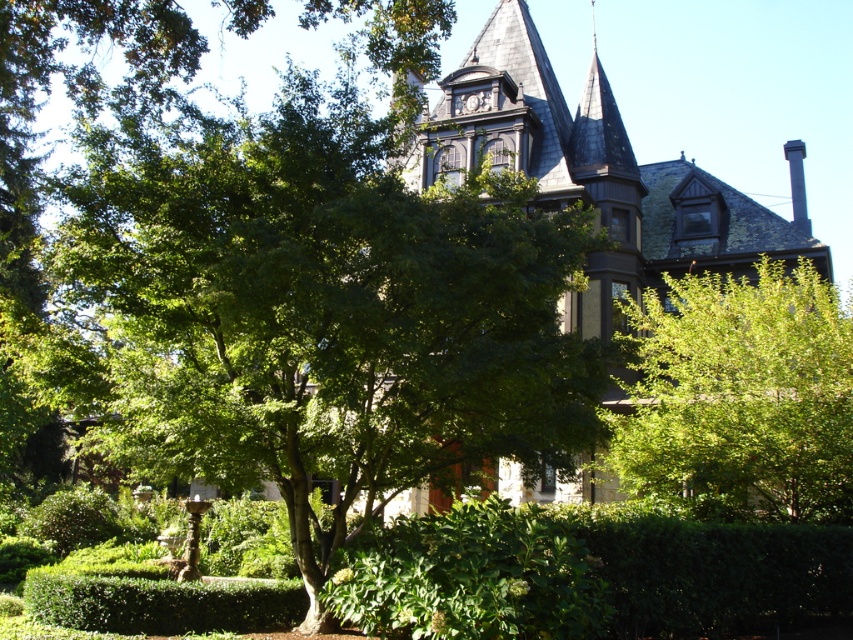
Question: Is green leafy tree at center positioned behind green leafy bush at right?

Choices:
 (A) no
 (B) yes

Answer: (A)

Question: Which of the following is the closest to the observer?

Choices:
 (A) green leafy bush at right
 (B) green leafy tree at center

Answer: (B)

Question: Which point appears closest to the camera in this image?

Choices:
 (A) (647, 412)
 (B) (473, 422)

Answer: (B)

Question: Is green leafy tree at center positioned in front of green leafy bush at right?

Choices:
 (A) no
 (B) yes

Answer: (B)

Question: Observing the image, what is the correct spatial positioning of green leafy tree at center in reference to green leafy bush at right?

Choices:
 (A) above
 (B) below

Answer: (A)